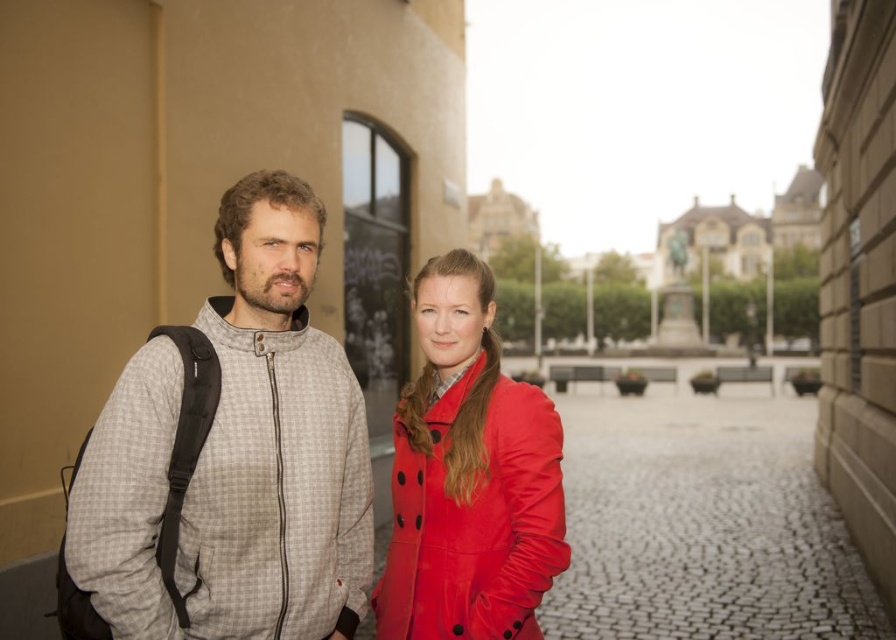
Is gray checkered jacket at left behind shiny red coat at center?

That is False.

Does point (194, 484) come in front of point (476, 353)?

Yes, point (194, 484) is in front of point (476, 353).

Where is `gray checkered jacket at left`? The image size is (896, 640). gray checkered jacket at left is located at coordinates (237, 454).